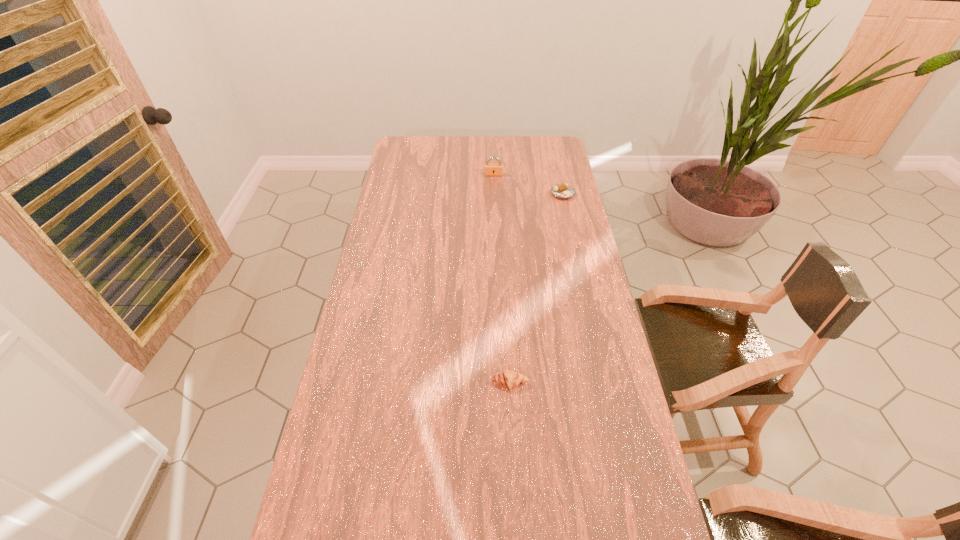
Locate an element on the screen. This screenshot has width=960, height=540. object that stands as the closest to the right pastry is located at coordinates (490, 169).

The width and height of the screenshot is (960, 540). I want to click on vacant area that satisfies the following two spatial constraints: 1. to unlock the second nearest object from the front; 2. on the left side of the padlock, so click(x=494, y=194).